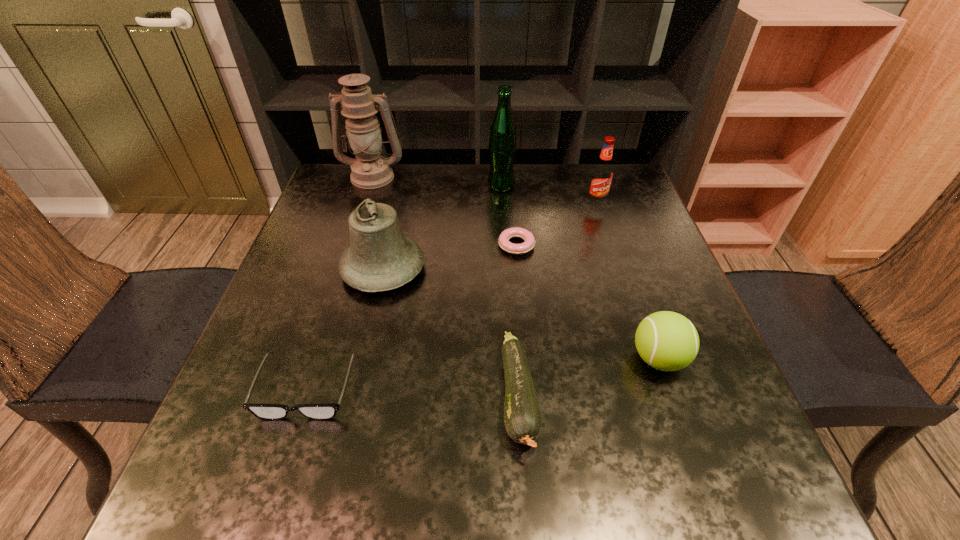
Identify the location of oil lamp. This screenshot has height=540, width=960. (370, 170).

Locate an element on the screen. beer bottle is located at coordinates (502, 147).

What are the coordinates of `the third farthest object` in the screenshot? It's located at (602, 173).

Locate an element on the screen. This screenshot has height=540, width=960. bell is located at coordinates (380, 258).

Image resolution: width=960 pixels, height=540 pixels. What are the coordinates of `tennis ball` in the screenshot? It's located at (668, 341).

Identify the location of zucchini. Image resolution: width=960 pixels, height=540 pixels. (522, 418).

Find the location of a particular element. This screenshot has width=960, height=540. spectacles is located at coordinates (327, 411).

At what (x,y) coordinates should I click in order to perform the action: click on doughnut. Please return your answer as a coordinate pair (x, y). This screenshot has width=960, height=540. Looking at the image, I should click on tap(516, 232).

The width and height of the screenshot is (960, 540). In order to click on free point located 0.140m on the right of the oil lamp in this screenshot , I will do `click(453, 176)`.

Image resolution: width=960 pixels, height=540 pixels. In order to click on vacant space positioned 0.100m on the right of the beer bottle in this screenshot , I will do `click(550, 186)`.